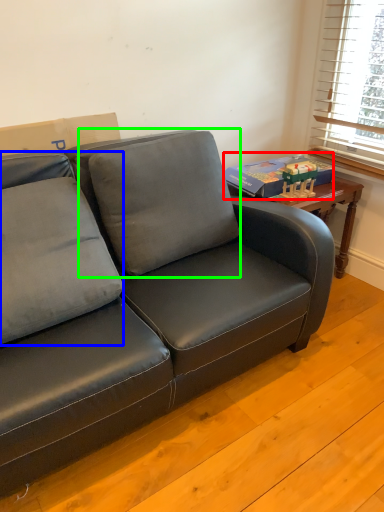
Question: Which object is positioned farthest from paperback book (highlighted by a red box)? Select from pillow (highlighted by a blue box) and pillow (highlighted by a green box).

Choices:
 (A) pillow
 (B) pillow

Answer: (A)